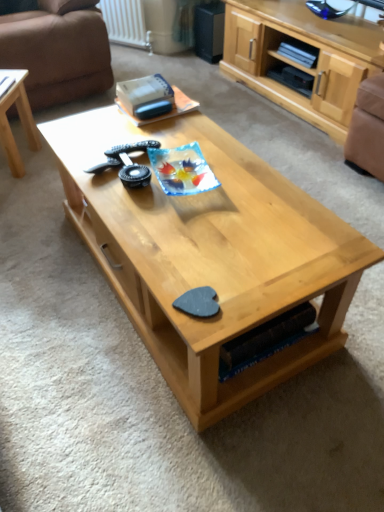
The height and width of the screenshot is (512, 384). I want to click on free region on the left part of natural wood coffee table at center, the 1th coffee table viewed from the right, so click(x=49, y=276).